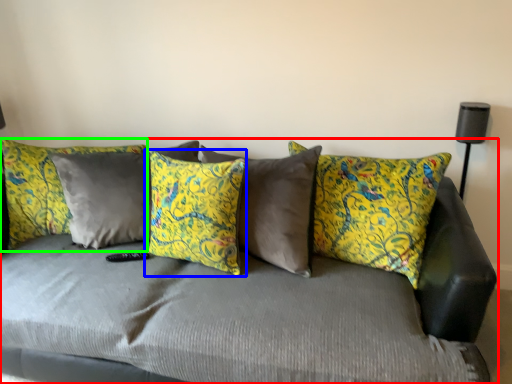
Question: Which object is positioned farthest from studio couch (highlighted by a red box)? Select from pillow (highlighted by a blue box) and pillow (highlighted by a green box).

Choices:
 (A) pillow
 (B) pillow

Answer: (B)